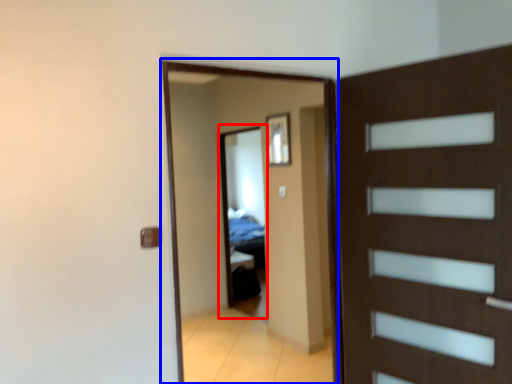
Question: Which object is further to the camera taking this photo, mirror (highlighted by a red box) or screen door (highlighted by a blue box)?

Choices:
 (A) mirror
 (B) screen door

Answer: (A)